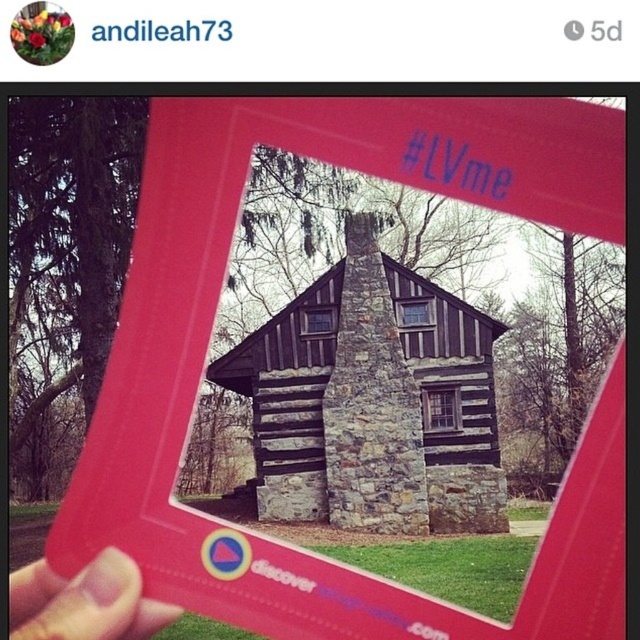
Can you confirm if dark brown wood log cabin at center is positioned above flesh-toned skin at lower left?

Actually, dark brown wood log cabin at center is below flesh-toned skin at lower left.

Between point (484, 346) and point (90, 637), which one is positioned behind?

Point (484, 346)

The height and width of the screenshot is (640, 640). Find the location of `dark brown wood log cabin at center`. dark brown wood log cabin at center is located at coordinates (372, 401).

Find the location of `dark brown wood log cabin at center`. dark brown wood log cabin at center is located at coordinates (x=372, y=401).